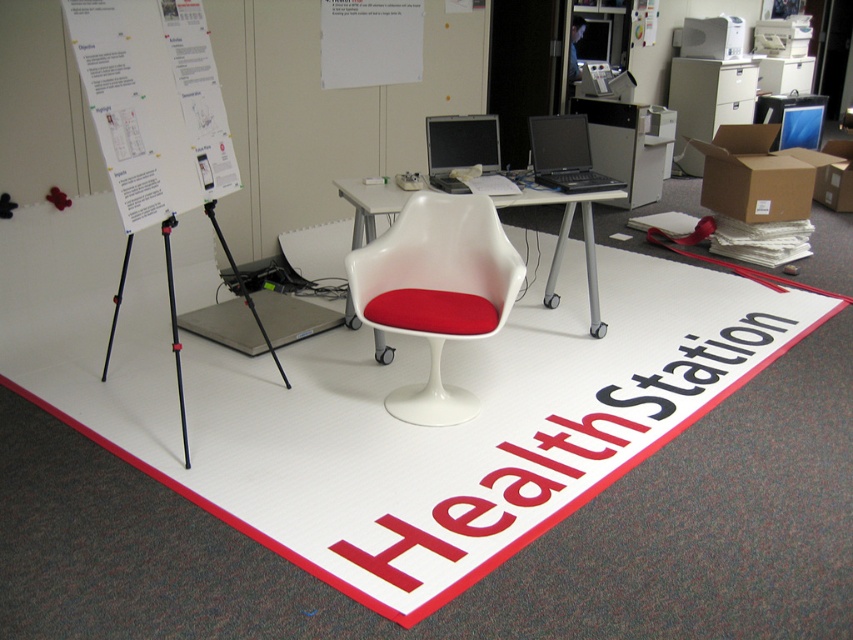
Question: Can you confirm if white plastic table at center is positioned above black glossy laptop at center?

Choices:
 (A) yes
 (B) no

Answer: (B)

Question: Which of the following is the closest to the observer?

Choices:
 (A) white plastic table at center
 (B) white plastic swivel chair at center

Answer: (B)

Question: Can you confirm if white plastic table at center is positioned to the right of black metal tripod at left?

Choices:
 (A) no
 (B) yes

Answer: (B)

Question: Which point appears farthest from the camera in this image?

Choices:
 (A) (352, 195)
 (B) (300, 429)
 (C) (572, 163)

Answer: (C)

Question: Which point appears farthest from the camera in this image?

Choices:
 (A) (759, 346)
 (B) (552, 186)
 (C) (444, 176)
 (D) (128, 160)

Answer: (A)

Question: Where is red vinyl healthstation at center located in relation to black glossy laptop at center in the image?

Choices:
 (A) right
 (B) left

Answer: (B)